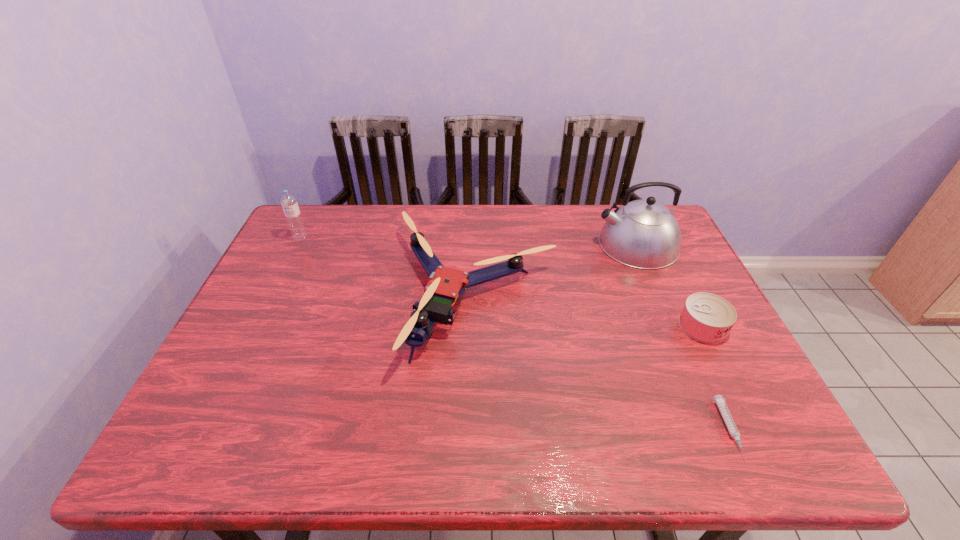
The image size is (960, 540). Find the location of `the tallest object`. the tallest object is located at coordinates (644, 234).

Identify the location of the second tallest object. (293, 216).

Identify the location of the leftmost object. The width and height of the screenshot is (960, 540). (293, 216).

Image resolution: width=960 pixels, height=540 pixels. What are the coordinates of `drone` in the screenshot? It's located at (446, 285).

Locate an element on the screen. the fourth object from right to left is located at coordinates (446, 285).

Identify the location of the second shortest object. This screenshot has height=540, width=960. (708, 318).

Where is `the nearest object`? This screenshot has height=540, width=960. the nearest object is located at coordinates (719, 400).

This screenshot has height=540, width=960. Identify the location of syringe. [719, 400].

Where is `vacant region located from the spout of the tallest object`? vacant region located from the spout of the tallest object is located at coordinates (504, 244).

This screenshot has height=540, width=960. In order to click on vacant space located 0.200m from the spout of the tallest object in this screenshot , I will do [x=533, y=244].